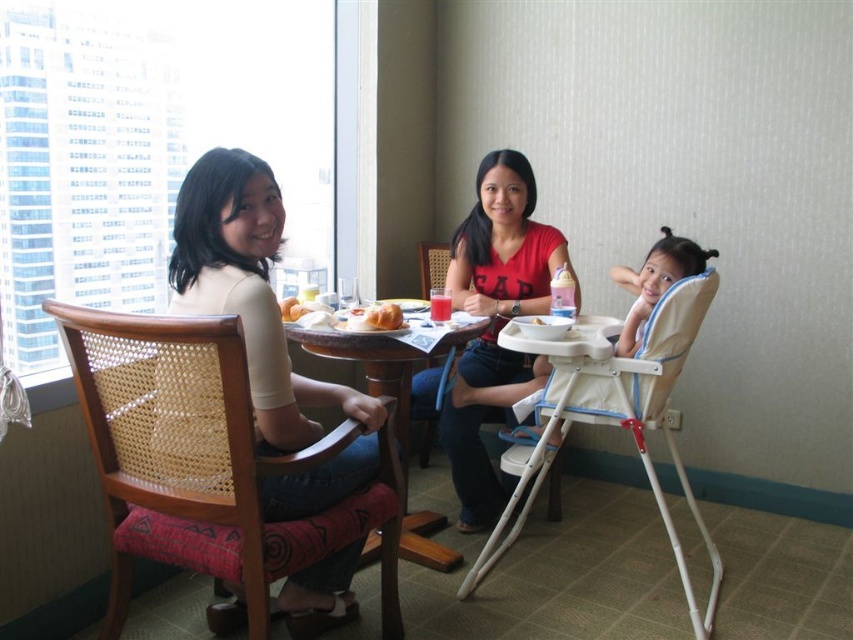
What do you see at coordinates (202, 460) in the screenshot? Image resolution: width=853 pixels, height=640 pixels. I see `woven wood chair at left` at bounding box center [202, 460].

Who is positioned more to the right, woven wood chair at left or matte red shirt at center?

matte red shirt at center

Which is behind, point (105, 449) or point (486, 314)?

The point (486, 314) is behind.

At what (x,y) coordinates should I click in order to perform the action: click on woven wood chair at left. Please return your answer as a coordinate pair (x, y). Image resolution: width=853 pixels, height=640 pixels. Looking at the image, I should click on (202, 460).

Does woven wood chair at left appear on the left side of matte white high chair at center?

Correct, you'll find woven wood chair at left to the left of matte white high chair at center.

Is woven wood chair at left bigger than matte white high chair at center?

Yes, woven wood chair at left is bigger than matte white high chair at center.

The width and height of the screenshot is (853, 640). What do you see at coordinates (202, 460) in the screenshot? I see `woven wood chair at left` at bounding box center [202, 460].

Locate an element on the screen. woven wood chair at left is located at coordinates (202, 460).

This screenshot has height=640, width=853. What do you see at coordinates (491, 323) in the screenshot?
I see `matte red shirt at center` at bounding box center [491, 323].

Measure the distance between matte red shirt at center and camera.

matte red shirt at center and camera are 7.83 feet apart from each other.

This screenshot has width=853, height=640. In order to click on matte red shirt at center in this screenshot , I will do `click(491, 323)`.